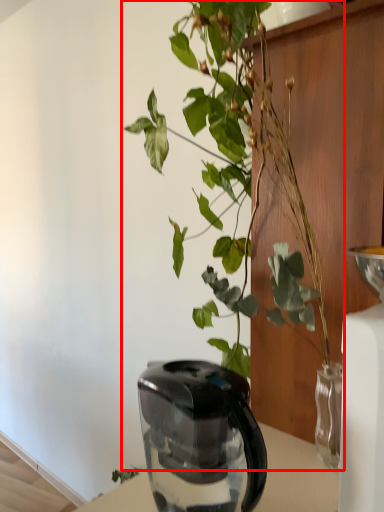
Question: Observing the image, what is the correct spatial positioning of houseplant (annotated by the red box) in reference to kettle?

Choices:
 (A) right
 (B) left

Answer: (A)